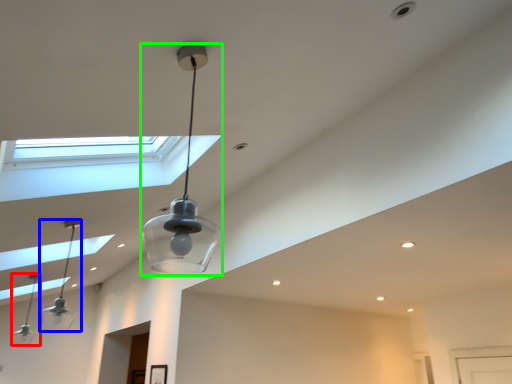
Question: Which object is the closest to the lamp (highlighted by a red box)? Choose among these: lamp (highlighted by a blue box) or lamp (highlighted by a green box).

Choices:
 (A) lamp
 (B) lamp

Answer: (A)